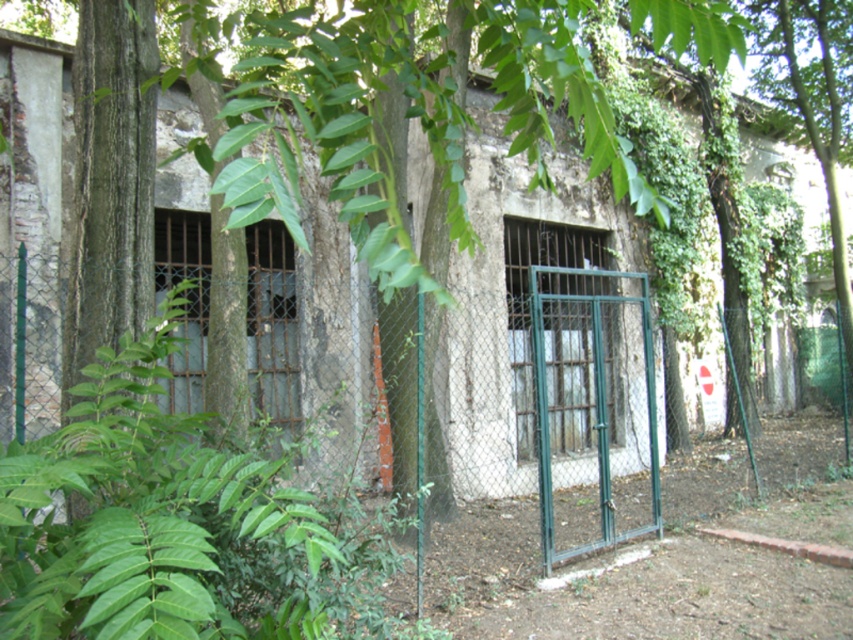
Question: Does green leafy plant at center appear on the right side of green metal gate at center?

Choices:
 (A) no
 (B) yes

Answer: (A)

Question: From the image, what is the correct spatial relationship of green leafy plant at center in relation to green metal gate at center?

Choices:
 (A) below
 (B) above

Answer: (A)

Question: Which point is closer to the camera?

Choices:
 (A) green metal gate at center
 (B) green leafy plant at center

Answer: (B)

Question: Which point is farther to the camera?

Choices:
 (A) (543, 333)
 (B) (161, 323)

Answer: (A)

Question: Can you confirm if green leafy plant at center is thinner than green metal gate at center?

Choices:
 (A) yes
 (B) no

Answer: (B)